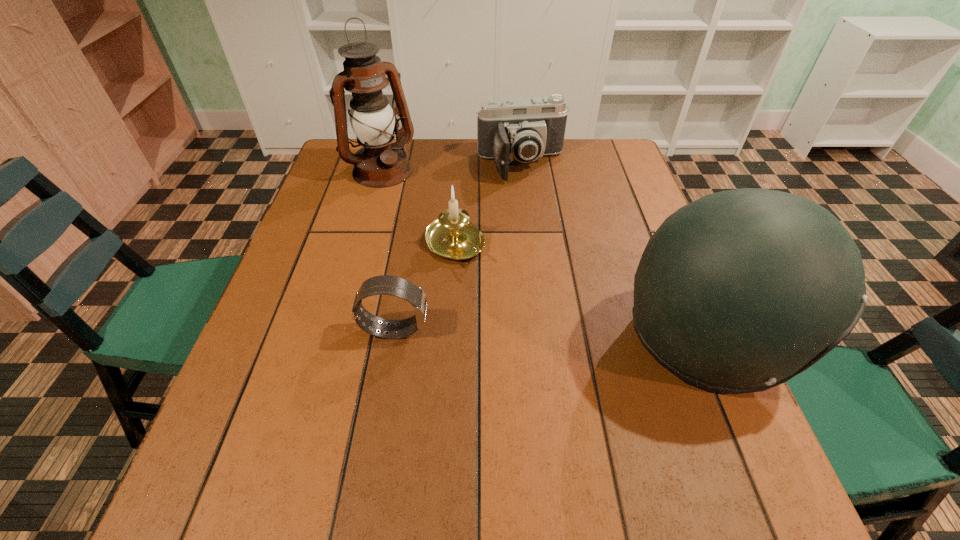
The width and height of the screenshot is (960, 540). What are the coordinates of `free space on the desktop that is between the watch and the football helmet and is positioned on the side of the tallest object, there is a wick adjustment knob` in the screenshot? It's located at click(x=537, y=334).

Identify the location of vacant space on the desktop that is between the shortest object and the football helmet and is positioned on the handle side of the candle holder. (543, 334).

Where is `vacant space on the desktop that is between the watch and the rightmost object and is positioned at the front of the camera with an open lens cover`? vacant space on the desktop that is between the watch and the rightmost object and is positioned at the front of the camera with an open lens cover is located at coordinates (578, 335).